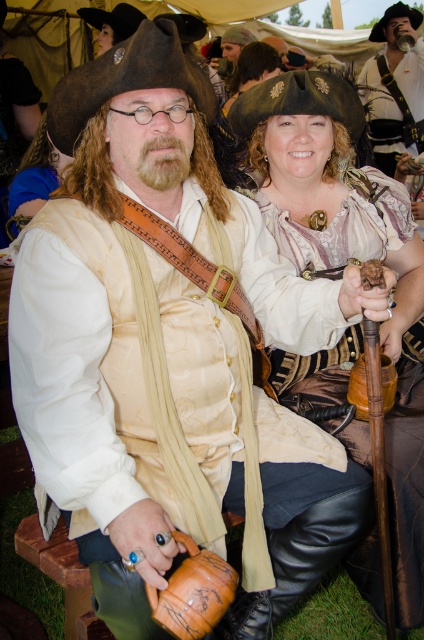
You are a photographer at the Renaissance fair and need to capture a closeup shot of both the matte gold chain at center and the matte gold armor at center. Since your camera can only focus on one object at a time, which object should you adjust the focus to first to ensure the other is still in the frame?

The matte gold chain at center is to the right of the matte gold armor at center, so you should focus on the matte gold armor at center first since it is on the left and the chain is next to it on the right, keeping both in frame when adjusting focus between them.

You are a costume designer observing the Renaissance fair scene. You notice the point at coordinate (x=395, y=88). What is the object located at that point?

The point at coordinate (x=395, y=88) indicates the matte white shirt at center.